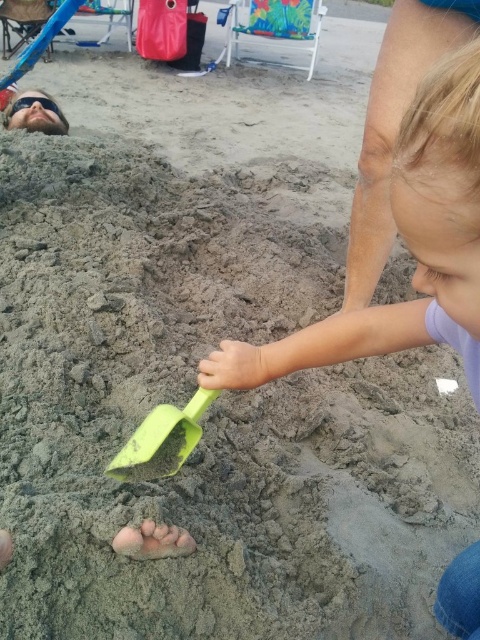
Question: Which of the following is the farthest from the observer?

Choices:
 (A) (143, 472)
 (B) (478, 355)

Answer: (A)

Question: Does pastel purple shirt at center have a smaller size compared to green plastic shovel at center?

Choices:
 (A) no
 (B) yes

Answer: (A)

Question: Observing the image, what is the correct spatial positioning of pastel purple shirt at center in reference to green plastic shovel at center?

Choices:
 (A) right
 (B) left

Answer: (A)

Question: Among these objects, which one is nearest to the camera?

Choices:
 (A) pastel purple shirt at center
 (B) green plastic shovel at center

Answer: (A)

Question: Among these points, which one is farthest from the camera?

Choices:
 (A) (146, 474)
 (B) (397, 147)

Answer: (A)

Question: Does pastel purple shirt at center have a greater width compared to green plastic shovel at center?

Choices:
 (A) no
 (B) yes

Answer: (B)